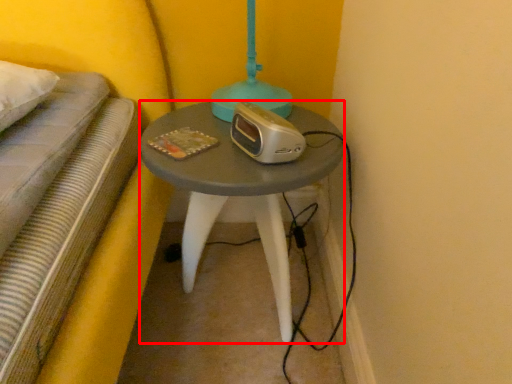
Question: Observing the image, what is the correct spatial positioning of table (annotated by the red box) in reference to appliance?

Choices:
 (A) left
 (B) right

Answer: (A)